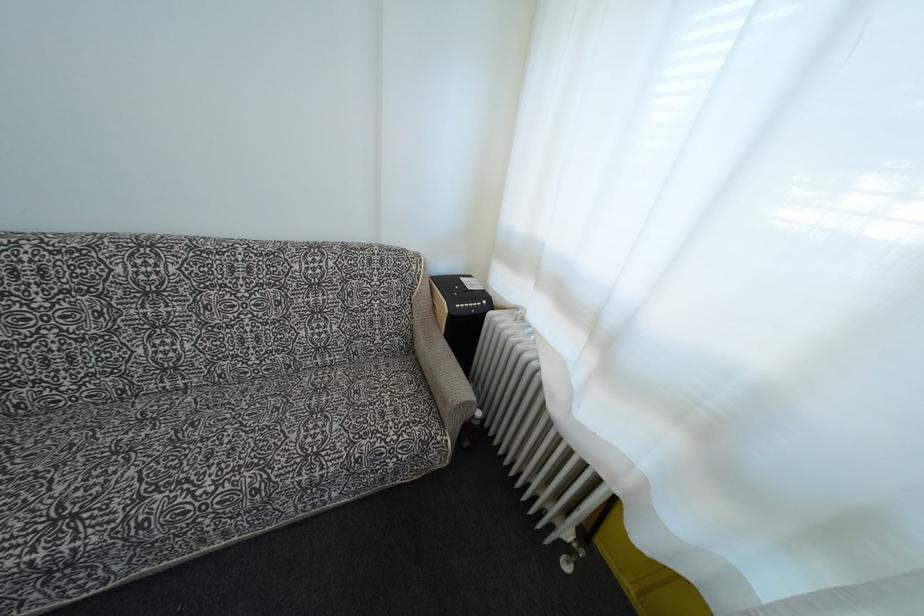
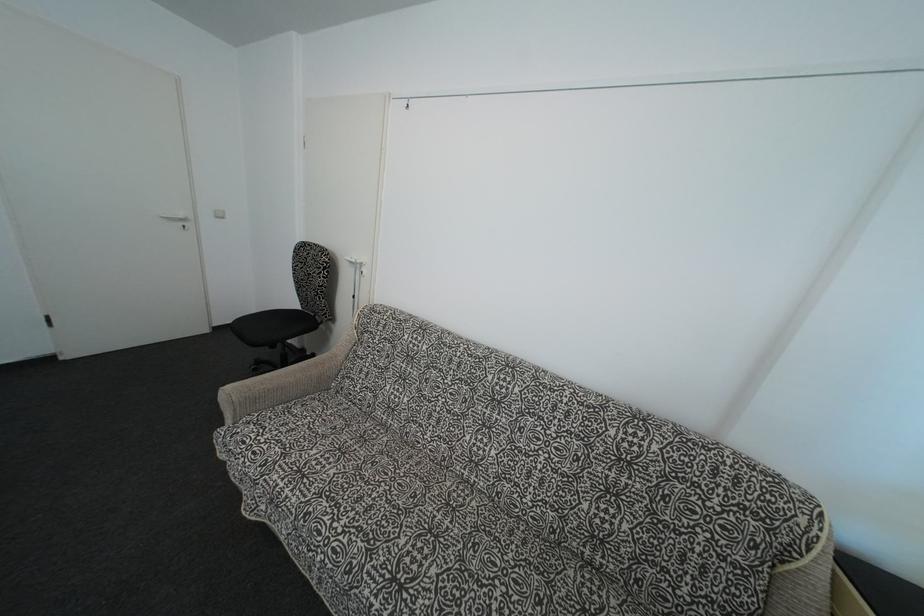
Question: Based on the continuous images, in which direction is the camera rotating? Reply with the corresponding letter.

Choices:
 (A) Left
 (B) Right
 (C) Up
 (D) Down

Answer: (A)